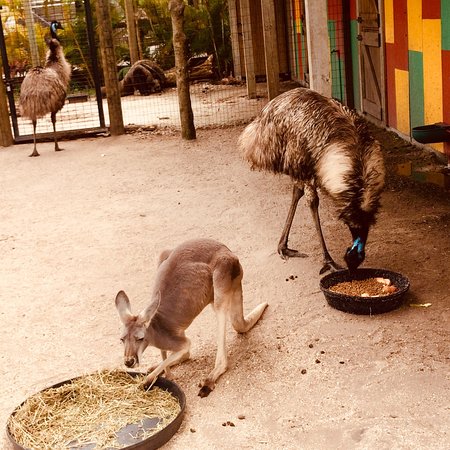
You are a GUI agent. You are given a task and a screenshot of the screen. Output one action in this format:
    pyautogui.click(x=<x>, y=<y>)
    Task: Click on the wall
    This screenshot has width=450, height=450.
    Given the screenshot: What is the action you would take?
    pyautogui.click(x=430, y=62)